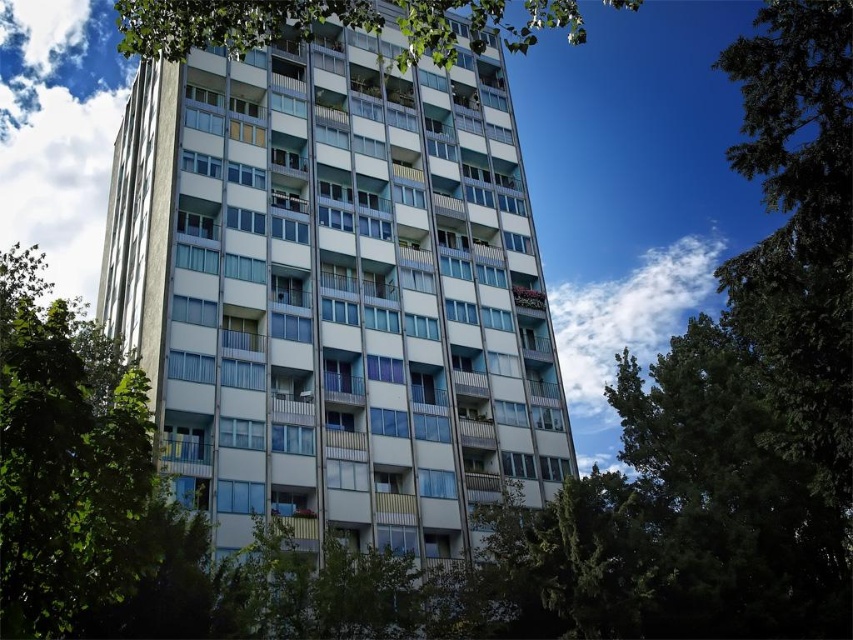
You are standing in front of the residential building. There is a green leafy tree at center. Can you see the tree from the first floor windows of the building?

Yes, because the green leafy tree at center is located at point (735, 396), which is near the bottom of the image and within the lower part of the building, so the first floor windows would have a clear view of it.

You are standing in front of the residential building and notice two points marked on the facade. The first point is located at coordinates point (x=160, y=221) and the second at point (x=643, y=500). Which point is closer to the front of the building?

Point (x=643, y=500) is closer to the front of the building because it is in front of point (x=160, y=221).

You are standing at the entrance of the residential area and want to locate the white glass building at center. According to the coordinates provided, where should you head to find it?

The white glass building at center is located at point [335,289], so you should head to that coordinate to find it.